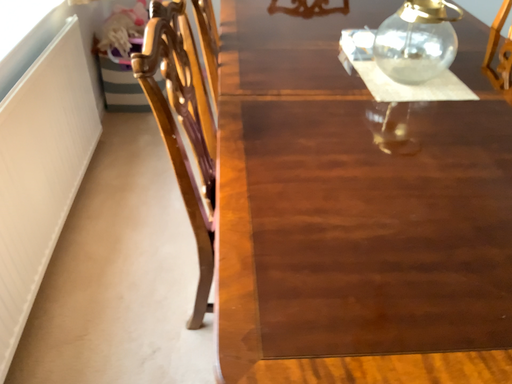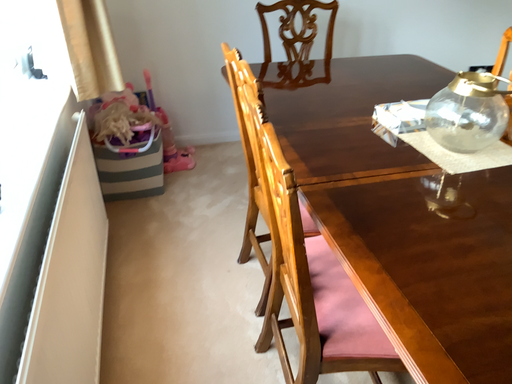
Question: Which way did the camera rotate in the video?

Choices:
 (A) rotated right
 (B) rotated left

Answer: (A)